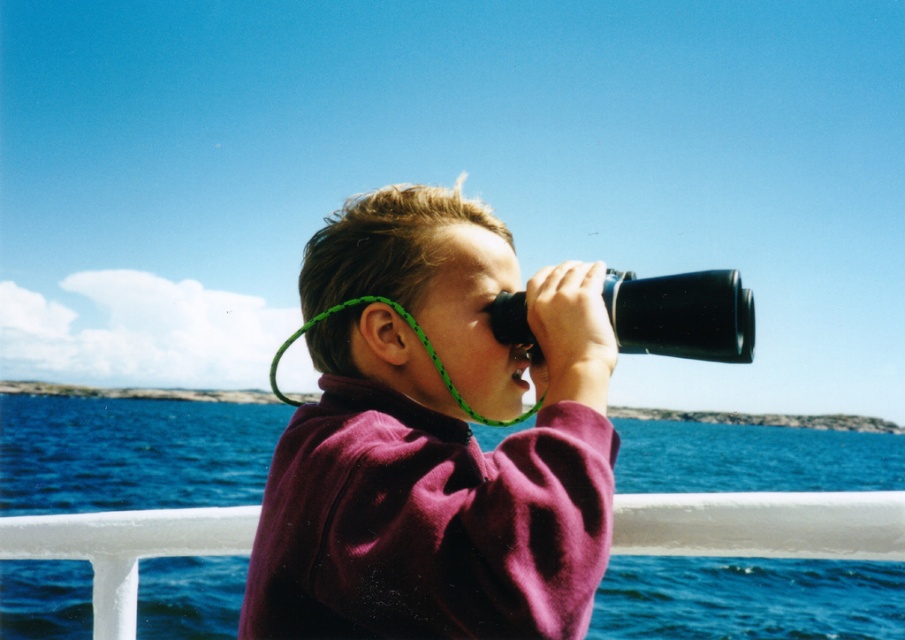
From the picture: Does purple fleece jacket at center have a greater height compared to blue water at lower center?

No.

Does point (339, 289) lie in front of point (120, 474)?

That is True.

I want to click on purple fleece jacket at center, so click(435, 440).

Identify the location of purple fleece jacket at center. (435, 440).